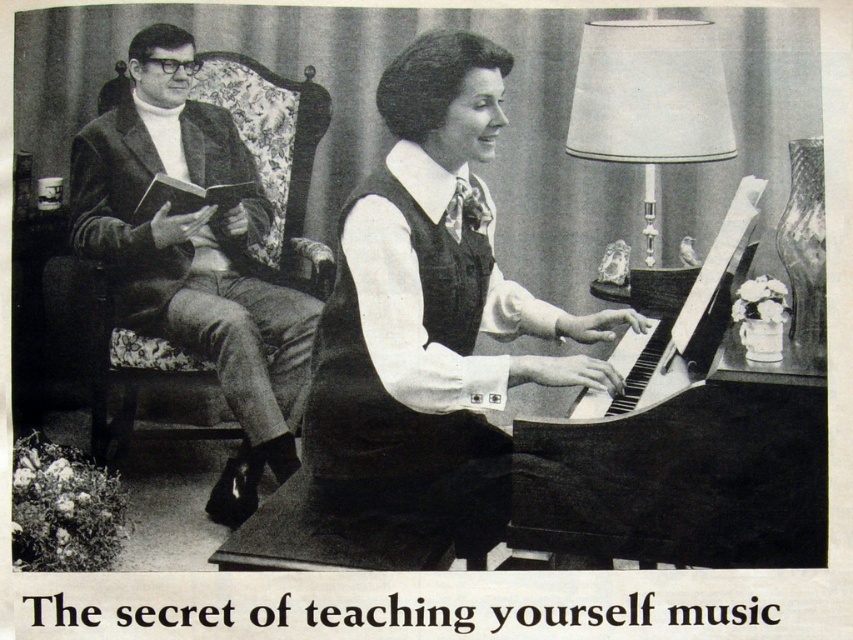
Question: Can you confirm if matte black jacket at left is positioned to the right of metallic silver lampshade at upper right?

Choices:
 (A) yes
 (B) no

Answer: (B)

Question: Which point is farther from the camera taking this photo?

Choices:
 (A) (698, 454)
 (B) (459, 67)
 (C) (173, 48)

Answer: (C)

Question: Observing the image, what is the correct spatial positioning of matte black piano at center in reference to black polished piano at center?

Choices:
 (A) left
 (B) right

Answer: (A)

Question: Which point is farther from the camera taking this photo?

Choices:
 (A) pos(347,387)
 (B) pos(680,154)

Answer: (B)

Question: Among these points, which one is farthest from the camera?

Choices:
 (A) (169, 307)
 (B) (816, 561)
 (C) (701, 70)

Answer: (A)

Question: In this image, where is black polished piano at center located relative to metallic silver lampshade at upper right?

Choices:
 (A) right
 (B) left

Answer: (B)